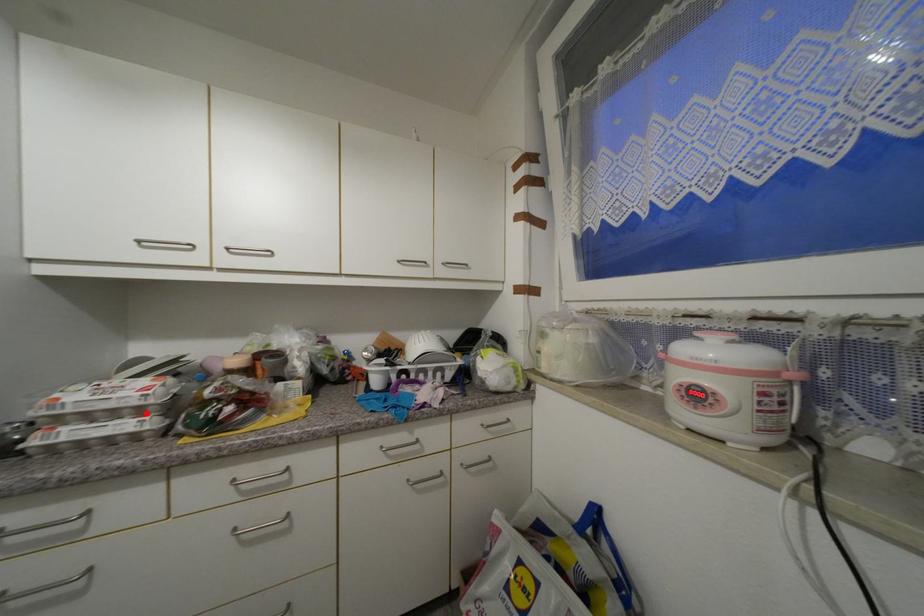
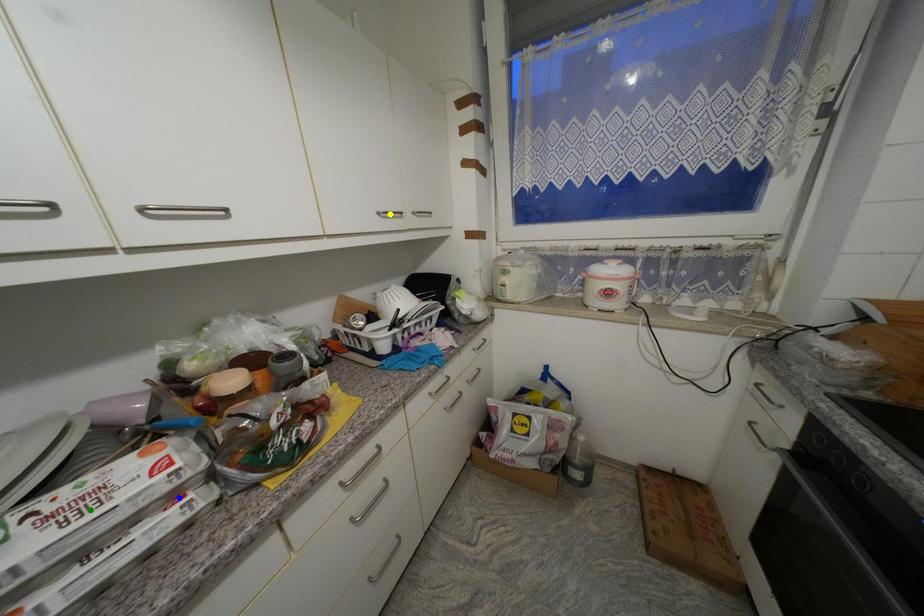
Question: I am providing you with two images of the same scene from different viewpoints. A red point is marked on the first image. You are given multiple points on the second image. Which mark in image 2 goes with the point in image 1?

Choices:
 (A) yellow point
 (B) green point
 (C) blue point

Answer: (C)